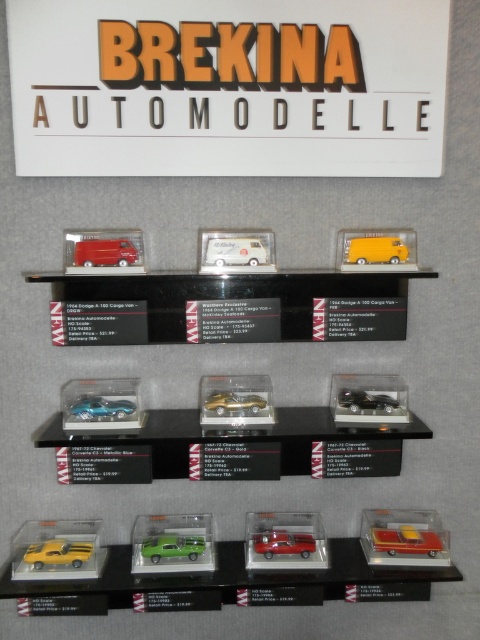
You are a customer looking at the Brekina Automodelle display. You see the orange plastic sign at upper center and the gold metallic car at center. Which object is taller?

The orange plastic sign at upper center has a greater height compared to the gold metallic car at center, so the orange plastic sign at upper center is taller.

You are standing in front of the Brekina Automodelle display. There is a point at coordinates (228,86). Based on the scene description, can you determine what object this point is located on?

The point at (228,86) is located on the orange plastic sign at upper center.